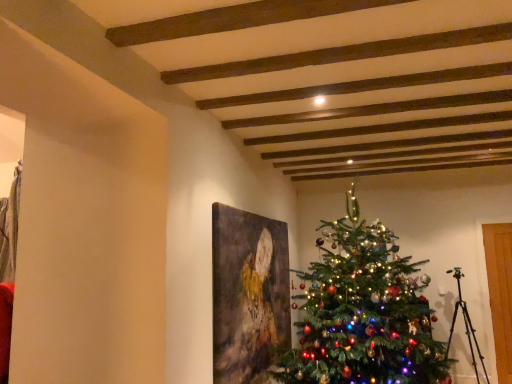
Find the location of a particular element. The image size is (512, 384). green matte christmas tree at center is located at coordinates (362, 312).

This screenshot has height=384, width=512. Describe the element at coordinates (362, 312) in the screenshot. I see `green matte christmas tree at center` at that location.

This screenshot has height=384, width=512. What do you see at coordinates (248, 295) in the screenshot?
I see `matte canvas painting at center` at bounding box center [248, 295].

Consider the image. In order to face matte canvas painting at center, should I rotate leftwards or rightwards?

Rotate your view right by about 1.015°.

The image size is (512, 384). Identify the location of matte canvas painting at center. (248, 295).

What is the approximate width of matte canvas painting at center?

It is 3.85 inches.

The image size is (512, 384). I want to click on green matte christmas tree at center, so (x=362, y=312).

Between green matte christmas tree at center and matte canvas painting at center, which one appears on the right side from the viewer's perspective?

From the viewer's perspective, green matte christmas tree at center appears more on the right side.

Between green matte christmas tree at center and matte canvas painting at center, which one is positioned behind?

matte canvas painting at center is further away from the camera.

Considering the positions of point (356, 267) and point (222, 287), is point (356, 267) closer or farther from the camera than point (222, 287)?

Clearly, point (356, 267) is more distant from the camera than point (222, 287).

From the image's perspective, who appears lower, green matte christmas tree at center or matte canvas painting at center?

matte canvas painting at center appears lower in the image.

From a real-world perspective, is green matte christmas tree at center located beneath matte canvas painting at center?

No.

Is green matte christmas tree at center wider than matte canvas painting at center?

Yes, green matte christmas tree at center is wider than matte canvas painting at center.

Is green matte christmas tree at center taller than matte canvas painting at center?

Correct, green matte christmas tree at center is much taller as matte canvas painting at center.

Based on the photo, who is smaller, green matte christmas tree at center or matte canvas painting at center?

With smaller size is matte canvas painting at center.

Would you say green matte christmas tree at center contains matte canvas painting at center?

Actually, matte canvas painting at center is outside green matte christmas tree at center.

Is green matte christmas tree at center placed right next to matte canvas painting at center?

No, green matte christmas tree at center is not with matte canvas painting at center.

Could you tell me if green matte christmas tree at center is turned towards matte canvas painting at center?

Yes, green matte christmas tree at center is aimed at matte canvas painting at center.

Identify the location of christmas tree that is on the right side of matte canvas painting at center. This screenshot has width=512, height=384. (362, 312).

Is matte canvas painting at center to the right of green matte christmas tree at center from the viewer's perspective?

Incorrect, matte canvas painting at center is not on the right side of green matte christmas tree at center.

Which object is further away from the camera, matte canvas painting at center or green matte christmas tree at center?

matte canvas painting at center is more distant.

Between point (288, 296) and point (304, 368), which one is positioned behind?

Point (288, 296)

From the image's perspective, does matte canvas painting at center appear lower than green matte christmas tree at center?

Yes, from the image's perspective, matte canvas painting at center is beneath green matte christmas tree at center.

From a real-world perspective, is matte canvas painting at center positioned above or below green matte christmas tree at center?

matte canvas painting at center is below green matte christmas tree at center.

Can you confirm if matte canvas painting at center is thinner than green matte christmas tree at center?

Yes.

Looking at this image, considering the relative sizes of matte canvas painting at center and green matte christmas tree at center in the image provided, is matte canvas painting at center taller than green matte christmas tree at center?

Incorrect, the height of matte canvas painting at center is not larger of that of green matte christmas tree at center.

Considering the relative sizes of matte canvas painting at center and green matte christmas tree at center in the image provided, is matte canvas painting at center smaller than green matte christmas tree at center?

Yes.

Is matte canvas painting at center located outside green matte christmas tree at center?

Yes.

Is matte canvas painting at center far away from green matte christmas tree at center?

matte canvas painting at center is actually quite close to green matte christmas tree at center.

Is matte canvas painting at center positioned with its back to green matte christmas tree at center?

That's right, matte canvas painting at center is facing away from green matte christmas tree at center.

The width and height of the screenshot is (512, 384). Identify the location of christmas tree on the right of matte canvas painting at center. (362, 312).

Locate an element on the screen. christmas tree on the right side of matte canvas painting at center is located at coordinates (362, 312).

Locate an element on the screen. picture frame that appears below the green matte christmas tree at center (from a real-world perspective) is located at coordinates (248, 295).